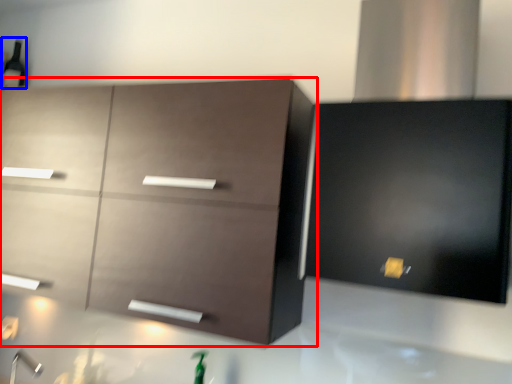
Question: Which point is closer to the camera, cabinetry (highlighted by a red box) or beer bottle (highlighted by a blue box)?

Choices:
 (A) cabinetry
 (B) beer bottle

Answer: (A)